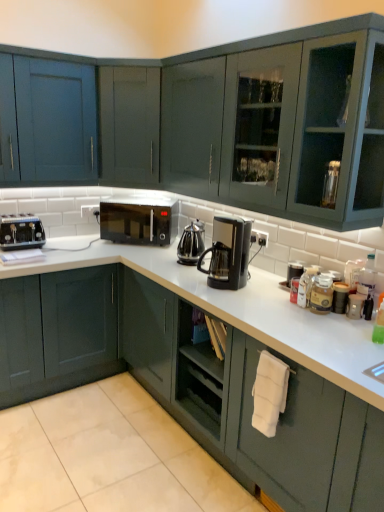
Find the location of a particular element. free location to the left of black plastic coffee maker at center is located at coordinates (197, 284).